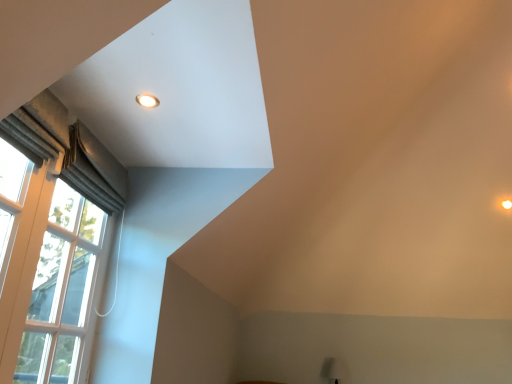
Question: Is matte white table lamp at lower right at the left side of matte white light fixture at upper left?

Choices:
 (A) no
 (B) yes

Answer: (A)

Question: From the image's perspective, is matte white table lamp at lower right under matte white light fixture at upper left?

Choices:
 (A) no
 (B) yes

Answer: (B)

Question: Is matte white table lamp at lower right further to the viewer compared to matte white light fixture at upper left?

Choices:
 (A) yes
 (B) no

Answer: (A)

Question: From the image's perspective, would you say matte white table lamp at lower right is positioned over matte white light fixture at upper left?

Choices:
 (A) no
 (B) yes

Answer: (A)

Question: Is matte white table lamp at lower right oriented away from matte white light fixture at upper left?

Choices:
 (A) yes
 (B) no

Answer: (B)

Question: Would you say matte white light fixture at upper left is part of matte white table lamp at lower right's contents?

Choices:
 (A) yes
 (B) no

Answer: (B)

Question: Considering the relative sizes of matte white light fixture at upper left and satin grey curtain at left in the image provided, is matte white light fixture at upper left bigger than satin grey curtain at left?

Choices:
 (A) yes
 (B) no

Answer: (B)

Question: Considering the relative sizes of matte white light fixture at upper left and satin grey curtain at left in the image provided, is matte white light fixture at upper left shorter than satin grey curtain at left?

Choices:
 (A) no
 (B) yes

Answer: (B)

Question: Does matte white light fixture at upper left have a greater width compared to satin grey curtain at left?

Choices:
 (A) yes
 (B) no

Answer: (B)

Question: Is matte white light fixture at upper left at the left side of satin grey curtain at left?

Choices:
 (A) yes
 (B) no

Answer: (B)

Question: Is the depth of matte white light fixture at upper left greater than that of satin grey curtain at left?

Choices:
 (A) yes
 (B) no

Answer: (B)

Question: Are matte white light fixture at upper left and satin grey curtain at left making contact?

Choices:
 (A) yes
 (B) no

Answer: (B)

Question: Is matte white table lamp at lower right further to camera compared to satin grey curtain at left?

Choices:
 (A) yes
 (B) no

Answer: (A)